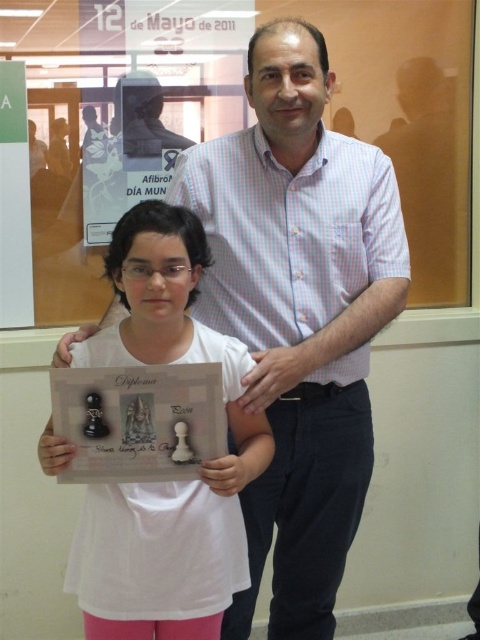
Question: Which point is closer to the camera taking this photo?

Choices:
 (A) (108, 428)
 (B) (347, 452)
 (C) (203, 337)

Answer: (A)

Question: Is light blue checkered shirt at center wider than white paper diploma at center?

Choices:
 (A) no
 (B) yes

Answer: (B)

Question: Does white paper diploma at center have a larger size compared to matte paper plaque at center?

Choices:
 (A) no
 (B) yes

Answer: (B)

Question: Considering the real-world distances, which object is farthest from the matte paper plaque at center?

Choices:
 (A) white paper diploma at center
 (B) light blue checkered shirt at center

Answer: (B)

Question: Is light blue checkered shirt at center thinner than matte paper plaque at center?

Choices:
 (A) no
 (B) yes

Answer: (A)

Question: Estimate the real-world distances between objects in this image. Which object is closer to the light blue checkered shirt at center?

Choices:
 (A) white paper diploma at center
 (B) matte paper plaque at center

Answer: (A)